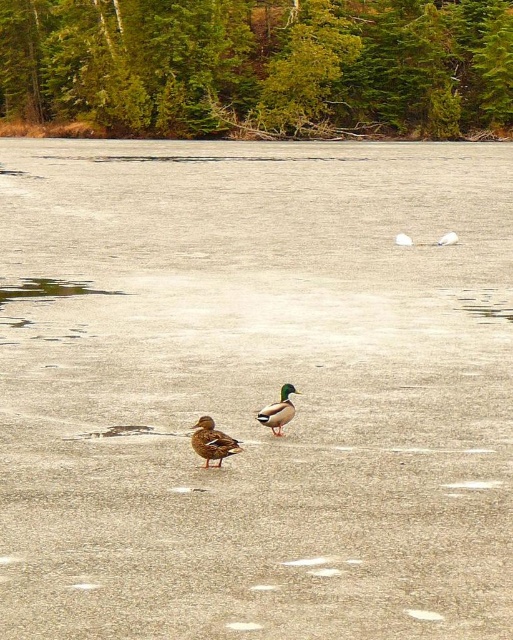
Question: Does brown matte duck at center appear under green matte duck at center?

Choices:
 (A) no
 (B) yes

Answer: (B)

Question: Is brown matte duck at center wider than green matte duck at center?

Choices:
 (A) no
 (B) yes

Answer: (B)

Question: Considering the relative positions of brown matte duck at center and green matte duck at center in the image provided, where is brown matte duck at center located with respect to green matte duck at center?

Choices:
 (A) right
 (B) left

Answer: (B)